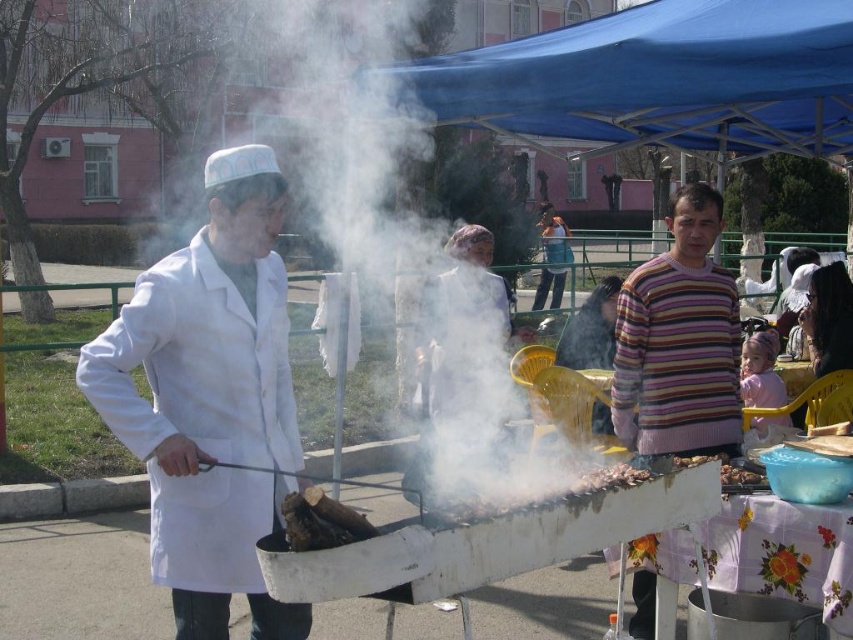
Question: From the image, what is the correct spatial relationship of blue fabric canopy at upper center in relation to charcoal wood at center?

Choices:
 (A) left
 (B) right

Answer: (B)

Question: Which of the following is the closest to the observer?

Choices:
 (A) (653, 294)
 (B) (346, 515)
 (C) (599, 474)
 (D) (746, 124)

Answer: (B)

Question: Which point is closer to the camera taking this photo?

Choices:
 (A) coord(351,513)
 (B) coord(756,481)
 (C) coord(584,476)

Answer: (A)

Question: Is white matte lab coat at left above blue fabric canopy at upper center?

Choices:
 (A) yes
 (B) no

Answer: (B)

Question: Does striped sweater at center have a larger size compared to charcoal grill at center?

Choices:
 (A) yes
 (B) no

Answer: (A)

Question: Which object is the farthest from the striped sweater at center?

Choices:
 (A) white matte lab coat at left
 (B) dark brown leather jacket at lower right
 (C) charcoal wood at center
 (D) charcoal wood at grill center

Answer: (D)